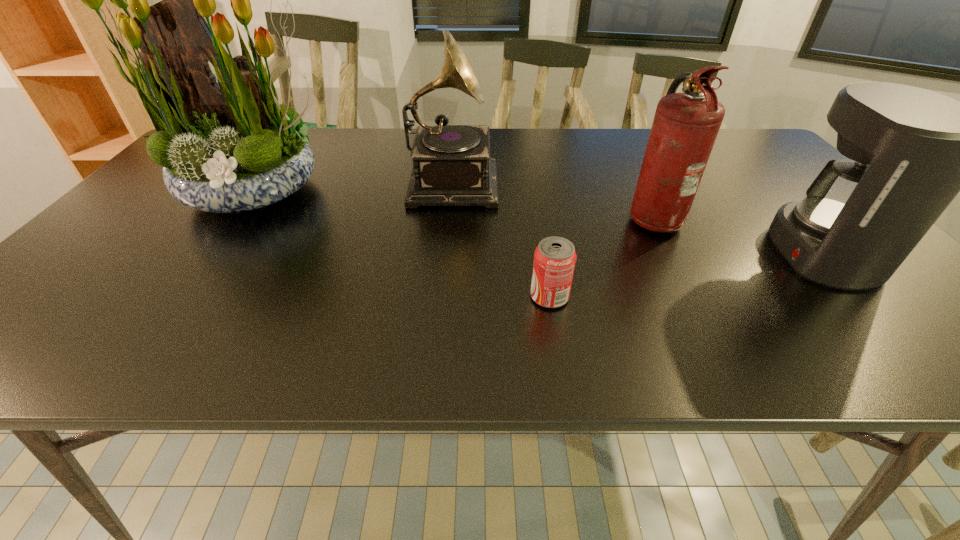
I want to click on object that is at the far left corner, so click(229, 146).

Where is `free spot at the far edge of the desktop`? free spot at the far edge of the desktop is located at coordinates (638, 148).

Where is `vacant space at the near edge of the desktop`? This screenshot has width=960, height=540. vacant space at the near edge of the desktop is located at coordinates (148, 360).

This screenshot has width=960, height=540. In order to click on vacant space at the left edge of the desktop in this screenshot , I will do pos(176,201).

I want to click on free location at the right edge of the desktop, so click(x=928, y=308).

Find the location of a particular element. vacant region at the near left corner of the desktop is located at coordinates (56, 332).

Image resolution: width=960 pixels, height=540 pixels. Identify the location of vacant space at the near right corner. 885,334.

I want to click on free spot between the rightmost object and the shortest object, so click(x=684, y=275).

Where is `vacant area that lies between the second object from left to right and the leftmost object`? This screenshot has width=960, height=540. vacant area that lies between the second object from left to right and the leftmost object is located at coordinates (353, 185).

Where is `empty location between the flower arrangement and the rightmost object`? The height and width of the screenshot is (540, 960). empty location between the flower arrangement and the rightmost object is located at coordinates (538, 222).